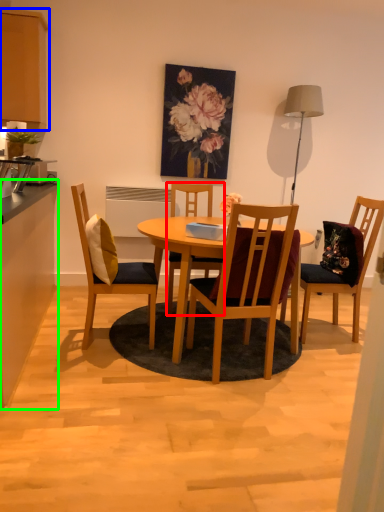
Question: Based on their relative distances, which object is farther from chair (highlighted by a red box)? Choose from cabinetry (highlighted by a blue box) and cabinetry (highlighted by a green box).

Choices:
 (A) cabinetry
 (B) cabinetry

Answer: (A)